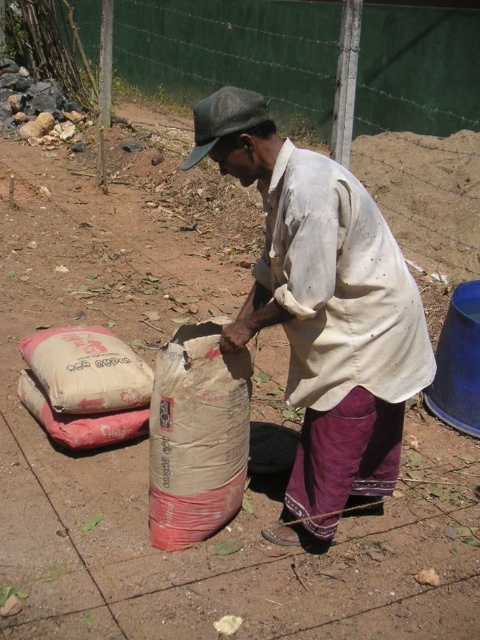
Can you confirm if beige fabric shirt at center is taller than dark gray fabric cap at upper center?

In fact, beige fabric shirt at center may be shorter than dark gray fabric cap at upper center.

Is point (268, 316) positioned after point (206, 147)?

Yes, point (268, 316) is farther from viewer.

Locate an element on the screen. beige fabric shirt at center is located at coordinates tap(323, 310).

Is point (268, 156) positioned in front of point (81, 346)?

Yes, it is in front of point (81, 346).

From the picture: Can you confirm if beige fabric shirt at center is bigger than white paper sack at lower left?

Yes.

Measure the distance between point (350, 273) and camera.

Point (350, 273) is 2.01 meters away from camera.

The image size is (480, 640). Identify the location of beige fabric shirt at center. (323, 310).

Between point (31, 337) and point (206, 154), which one is positioned in front?

Positioned in front is point (206, 154).

Is point (98, 401) more distant than point (229, 106)?

Yes, point (98, 401) is behind point (229, 106).

The height and width of the screenshot is (640, 480). I want to click on white paper sack at lower left, so tap(86, 369).